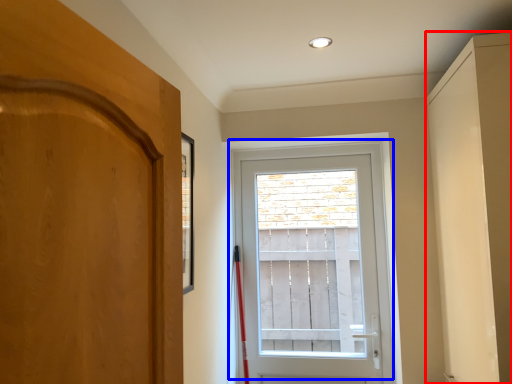
Question: Which object is closer to the camera taking this photo, cabinetry (highlighted by a red box) or door (highlighted by a blue box)?

Choices:
 (A) cabinetry
 (B) door

Answer: (A)